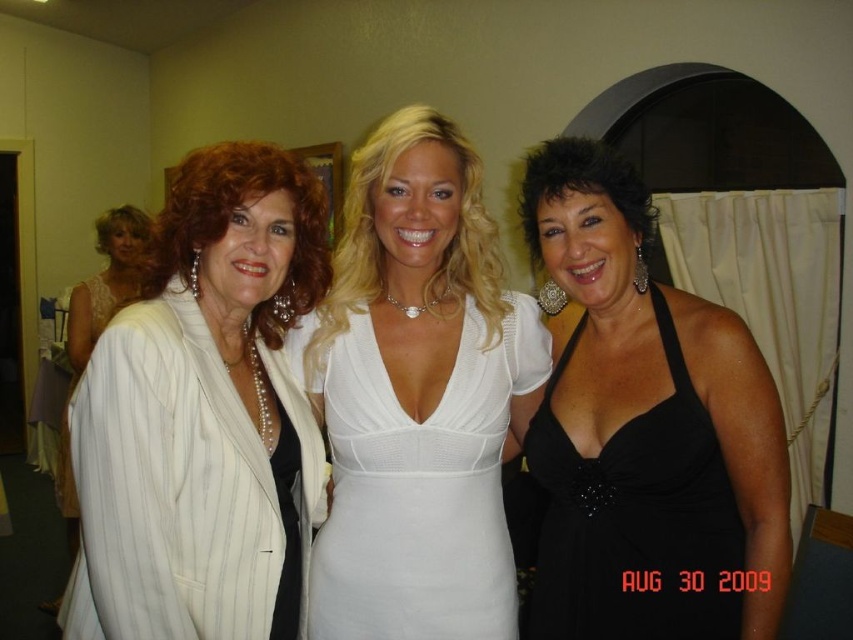
In the scene shown: You are standing in the same room as the three women in the image. You want to walk from the point marked as point 1 at point (155,554) to the point marked as point 2 at point (364,464). Can you walk directly from point 1 to point 2 without any obstacles?

Point 1 at point (155,554) is in front of point 2 at point (364,464), so there is no obstacle between them. You can walk directly from point 1 to point 2 without any issues.

You are a photographer adjusting your camera settings to focus on the black satin dress at center and the white striped suit at left. Which one should you focus on first if you want to ensure both are in sharp focus?

The black satin dress at center is closer to the viewer than the white striped suit at left, so you should focus on the black satin dress at center first to ensure both are in sharp focus.

You are a photographer setting up for a group photo. You need to ensure there is enough space between the white mesh dress at center and the black satin dress at center so that the camera can capture both clearly. The minimum required distance for clear capture is 10 inches. Based on the scene, is the current distance sufficient?

The white mesh dress at center is 8.33 inches away from the black satin dress at center. Since the minimum required distance for clear capture is 10 inches, the current distance of 8.33 inches is insufficient. The photographer needs to adjust their positions to increase the distance between them to meet the requirement.